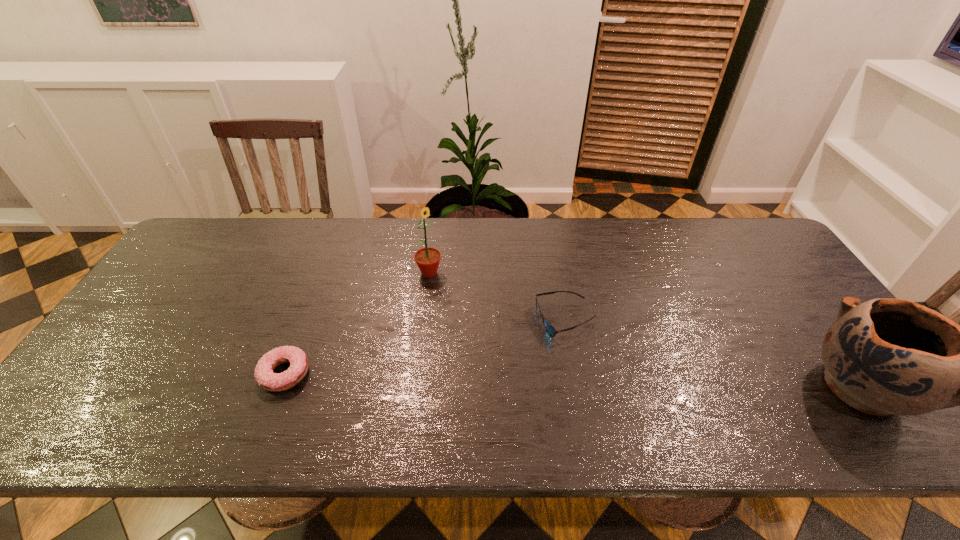
Where is `free space between the leftmost object and the second object from left to right`? The image size is (960, 540). free space between the leftmost object and the second object from left to right is located at coordinates (357, 323).

Where is `empty location between the pottery and the sunglasses`? Image resolution: width=960 pixels, height=540 pixels. empty location between the pottery and the sunglasses is located at coordinates (713, 354).

The height and width of the screenshot is (540, 960). What are the coordinates of `free space between the sunglasses and the leftmost object` in the screenshot? It's located at (425, 347).

Where is `free space between the sunglasses and the doughnut`? free space between the sunglasses and the doughnut is located at coordinates (425, 347).

Identify the location of blank region between the second object from left to right and the rightmost object. The image size is (960, 540). (645, 329).

Identify the location of object that stands as the third closest to the doughnut. (886, 356).

This screenshot has height=540, width=960. In order to click on object identified as the second closest to the second object from left to right in this screenshot , I will do `click(267, 379)`.

The width and height of the screenshot is (960, 540). I want to click on free point that satisfies the following two spatial constraints: 1. on the front side of the rightmost object; 2. on the left side of the doughnut, so click(x=279, y=386).

Where is `free space that satisfies the following two spatial constraints: 1. on the front side of the second object from right to left; 2. on the right side of the rightmost object`? The height and width of the screenshot is (540, 960). free space that satisfies the following two spatial constraints: 1. on the front side of the second object from right to left; 2. on the right side of the rightmost object is located at coordinates (578, 386).

Where is `free space that satisfies the following two spatial constraints: 1. on the front side of the third nearest object; 2. on the right side of the sunflower`? The width and height of the screenshot is (960, 540). free space that satisfies the following two spatial constraints: 1. on the front side of the third nearest object; 2. on the right side of the sunflower is located at coordinates (423, 321).